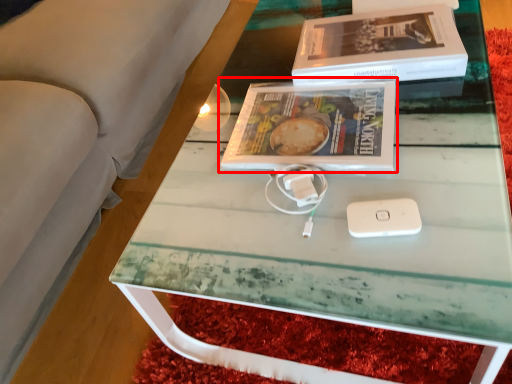
Question: Considering the relative positions of book (annotated by the red box) and box in the image provided, where is book (annotated by the red box) located with respect to the staircase?

Choices:
 (A) right
 (B) left

Answer: (B)